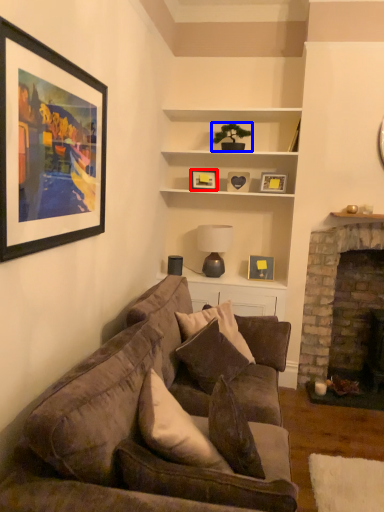
Question: Among these objects, which one is farthest to the camera, picture frame (highlighted by a red box) or houseplant (highlighted by a blue box)?

Choices:
 (A) picture frame
 (B) houseplant

Answer: (A)